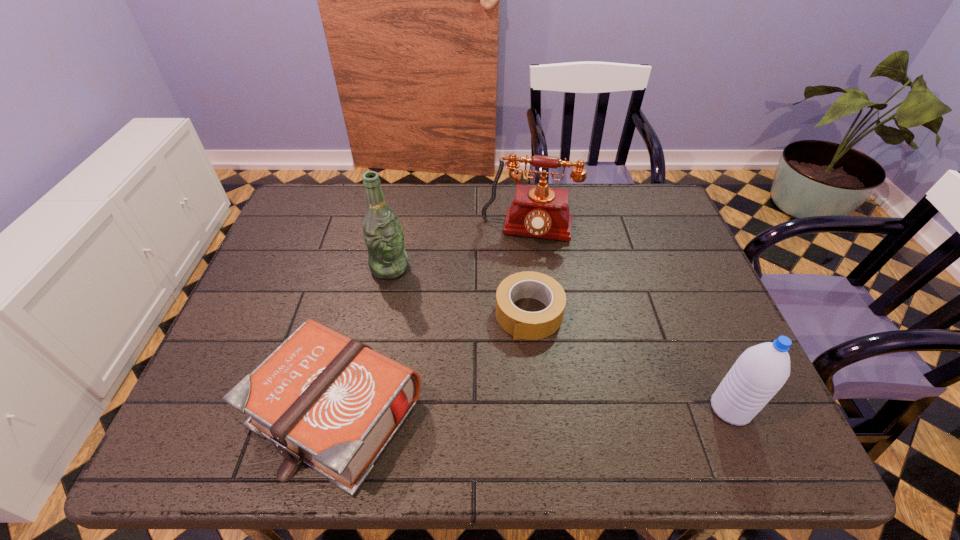
Identify which object is the third closest to the Bible. Please provide its 2D coordinates. Your answer should be formatted as a tuple, i.e. [(x, y)], where the tuple contains the x and y coordinates of a point satisfying the conditions above.

[(540, 211)]

I want to click on the third closest object to the beer bottle, so click(521, 324).

This screenshot has width=960, height=540. I want to click on free space that satisfies the following two spatial constraints: 1. on the back side of the second shortest object; 2. on the right side of the shortest object, so click(360, 313).

The width and height of the screenshot is (960, 540). What are the coordinates of `vacant space that satisfies the following two spatial constraints: 1. on the front side of the rightmost object; 2. on the right side of the beer bottle` in the screenshot? It's located at (361, 409).

Identify the location of vacant space that satisfies the following two spatial constraints: 1. on the front side of the water bottle; 2. on the right side of the fourth nearest object. The image size is (960, 540). (361, 409).

In order to click on blank area in the image that satisfies the following two spatial constraints: 1. on the back side of the telephone; 2. on the left side of the third farthest object in this screenshot , I will do `click(521, 231)`.